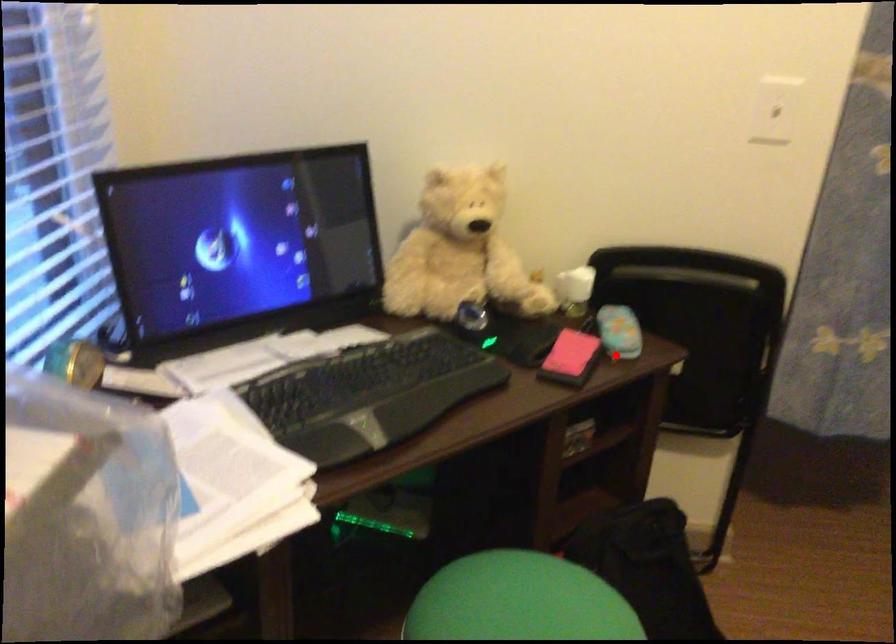
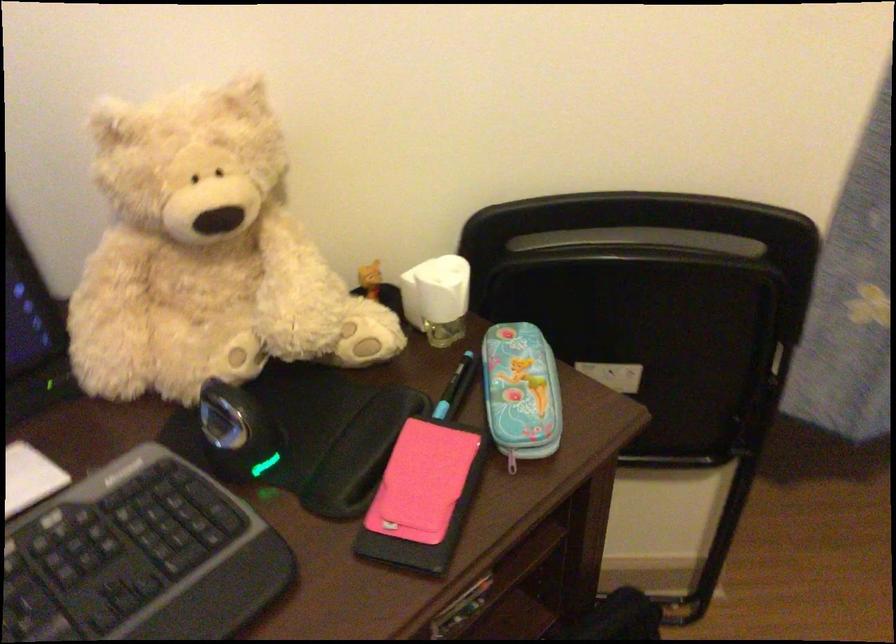
Where in the second image is the point corresponding to the highlighted location from the first image?

(512, 460)